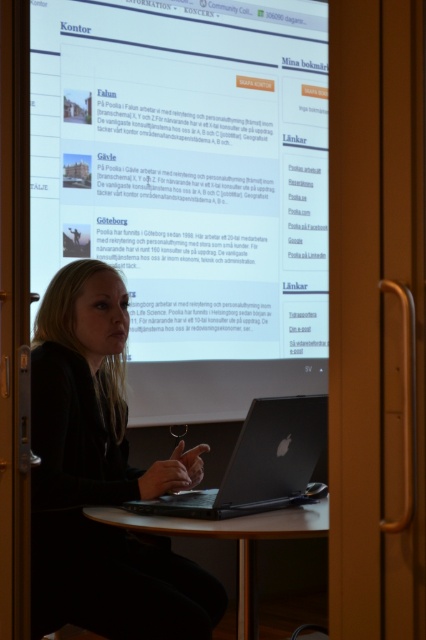
You are a guest attending a virtual meeting with the woman in the scene. You notice the black matte jacket at center and the sleek silver laptop at center. Which object is positioned higher in the image?

The black matte jacket at center is located above the sleek silver laptop at center in the image.

You are a guest attending a presentation and notice the black matte jacket at center and the brown wooden table at center in the scene. Which object is taller?

The black matte jacket at center is much taller than the brown wooden table at center.